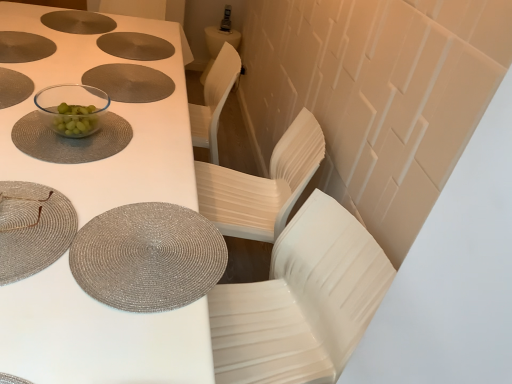
Locate an element on the screen. Image resolution: width=512 pixels, height=384 pixels. vacant space that is in between matte silver placemat at center and transparent glass bowl at center, placed as the fourth tableware when sorted from bottom to top is located at coordinates (101, 104).